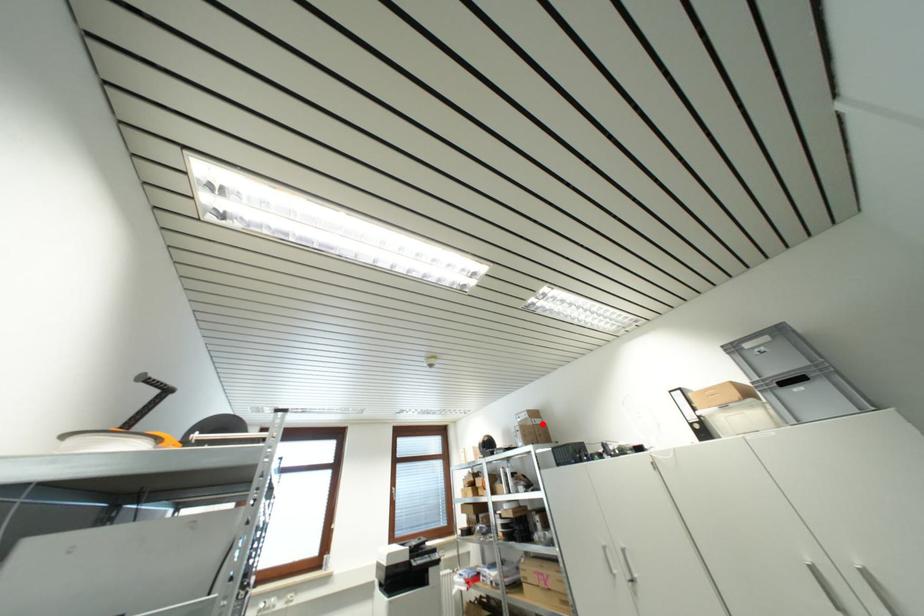
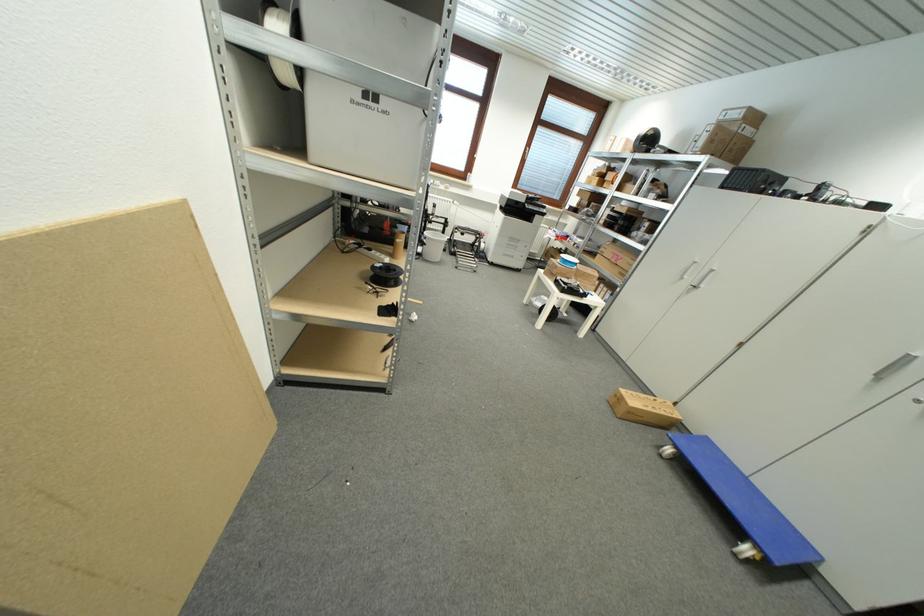
In the second image, find the point that corresponds to the highlighted location in the first image.

(754, 134)